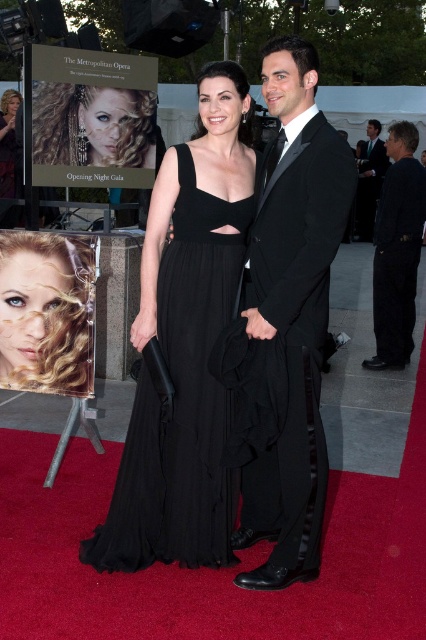
You are standing at point (359, 170) and want to walk to the central figures on the red carpet. Is the point (212, 378) between you and the central figures?

Yes, point (212, 378) is between you and the central figures because it is in front of point (359, 170) where you are standing.